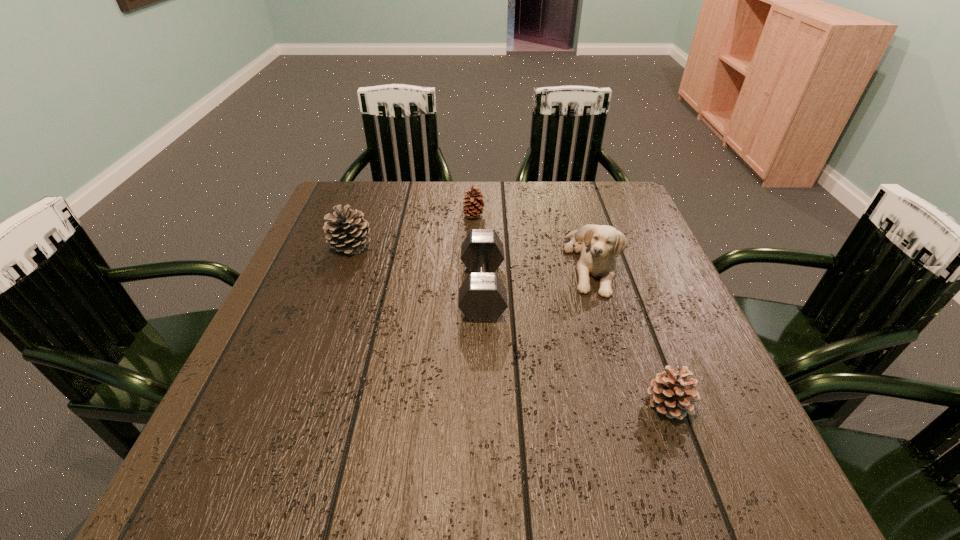
Locate an element on the screen. The width and height of the screenshot is (960, 540). the fourth closest object to the leftmost object is located at coordinates (671, 393).

You are a GUI agent. You are given a task and a screenshot of the screen. Output one action in this format:
    pyautogui.click(x=<x>, y=<y>)
    Task: Click on the second closest object to the second pinecone from right to left
    This screenshot has width=960, height=540.
    Given the screenshot: What is the action you would take?
    pyautogui.click(x=599, y=245)

Locate which pinecone is the closest to the tallest pinecone. Please provide its 2D coordinates. Your answer should be formatted as a tuple, i.e. [(x, y)], where the tuple contains the x and y coordinates of a point satisfying the conditions above.

[(475, 206)]

The image size is (960, 540). I want to click on pinecone object that ranks as the closest to the nearest pinecone, so click(x=475, y=206).

Identify the location of vacant space that satisfies the following two spatial constraints: 1. on the front side of the farthest object; 2. on the right side of the nearest pinecone. This screenshot has height=540, width=960. (470, 404).

Where is `vacant space that satisfies the following two spatial constraints: 1. on the front side of the rightmost pinecone; 2. on the right side of the dumbbell`? vacant space that satisfies the following two spatial constraints: 1. on the front side of the rightmost pinecone; 2. on the right side of the dumbbell is located at coordinates (483, 404).

Find the location of `free spot that satisfies the following two spatial constraints: 1. on the front-facing side of the puppy; 2. on the left side of the nearest object`. free spot that satisfies the following two spatial constraints: 1. on the front-facing side of the puppy; 2. on the left side of the nearest object is located at coordinates (633, 404).

This screenshot has height=540, width=960. Find the location of `vacant point that satisfies the following two spatial constraints: 1. on the front side of the second pinecone from left to right; 2. on the left side of the nearest pinecone`. vacant point that satisfies the following two spatial constraints: 1. on the front side of the second pinecone from left to right; 2. on the left side of the nearest pinecone is located at coordinates (470, 404).